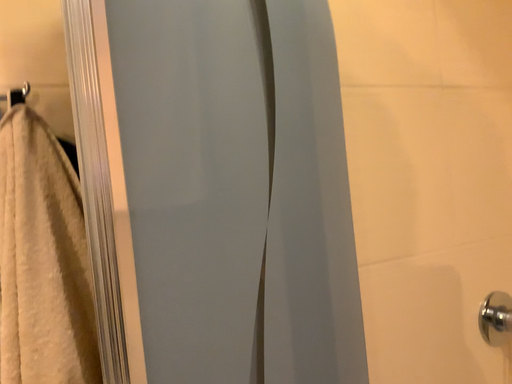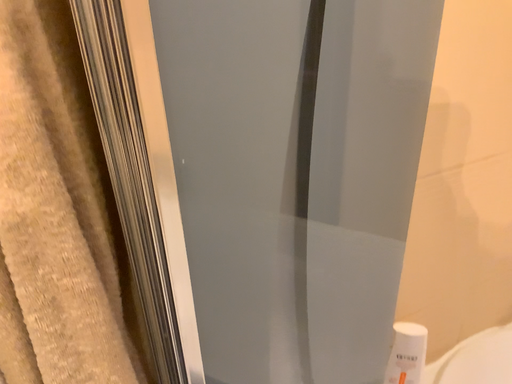
Question: Which way did the camera rotate in the video?

Choices:
 (A) rotated upward
 (B) rotated downward

Answer: (B)